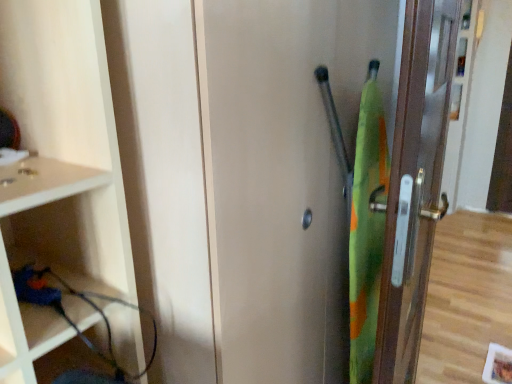
Question: Should I look upward or downward to see metallic gold door at right?

Choices:
 (A) down
 (B) up

Answer: (A)

Question: Should I look upward or downward to see green fabric screen door at right?

Choices:
 (A) up
 (B) down

Answer: (B)

Question: Is green fabric screen door at right in front of metallic gold door at right?

Choices:
 (A) yes
 (B) no

Answer: (A)

Question: Can you confirm if green fabric screen door at right is positioned to the left of metallic gold door at right?

Choices:
 (A) no
 (B) yes

Answer: (B)

Question: Is green fabric screen door at right bigger than metallic gold door at right?

Choices:
 (A) yes
 (B) no

Answer: (A)

Question: Does green fabric screen door at right have a lesser width compared to metallic gold door at right?

Choices:
 (A) yes
 (B) no

Answer: (A)

Question: Considering the relative sizes of green fabric screen door at right and metallic gold door at right in the image provided, is green fabric screen door at right taller than metallic gold door at right?

Choices:
 (A) yes
 (B) no

Answer: (A)

Question: Is the depth of green fabric screen door at right greater than that of metallic gold door at right?

Choices:
 (A) yes
 (B) no

Answer: (B)

Question: Is metallic gold door at right facing away from green fabric screen door at right?

Choices:
 (A) no
 (B) yes

Answer: (A)

Question: Is metallic gold door at right aimed at green fabric screen door at right?

Choices:
 (A) no
 (B) yes

Answer: (A)

Question: Considering the relative positions of metallic gold door at right and green fabric screen door at right in the image provided, is metallic gold door at right to the right of green fabric screen door at right from the viewer's perspective?

Choices:
 (A) no
 (B) yes

Answer: (B)

Question: Is metallic gold door at right far away from green fabric screen door at right?

Choices:
 (A) yes
 (B) no

Answer: (B)

Question: From a real-world perspective, is metallic gold door at right under green fabric screen door at right?

Choices:
 (A) no
 (B) yes

Answer: (A)

Question: Can we say metallic gold door at right lies outside green fabric screen door at right?

Choices:
 (A) yes
 (B) no

Answer: (A)

Question: Is metallic gold door at right in front of or behind green fabric screen door at right in the image?

Choices:
 (A) behind
 (B) front

Answer: (A)